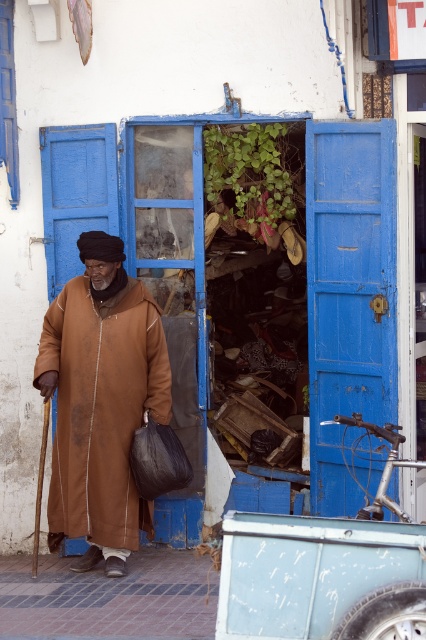
Which is more to the left, blue wooden door at right or brown matte robe at center?

brown matte robe at center is more to the left.

Is point (322, 342) farther from camera compared to point (80, 461)?

Yes.

Find the location of a particular element. blue wooden door at right is located at coordinates (348, 296).